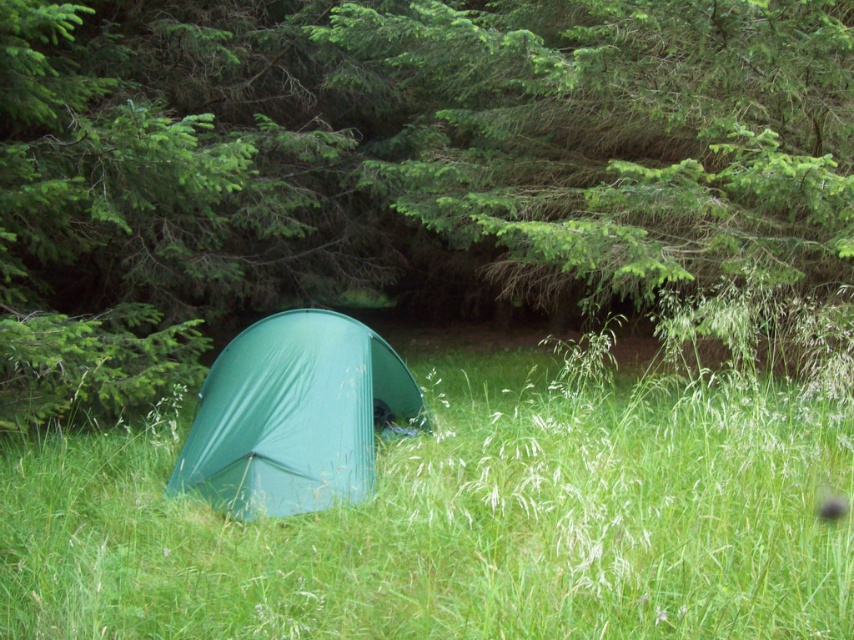
You are planning to set up a tent in this grassy area. You have two options available to you, the green fabric tent at center and the green tarpaulin tent at center. Considering the space available, which one would you choose and why?

The green fabric tent at center has a smaller size compared to the green tarpaulin tent at center. Therefore, if space is a concern, the green fabric tent at center would be the better choice as it requires less space to set up.

You are a hiker who wants to set up a tent in this area. You have two tents available, the green matte tent at center and the green tarpaulin tent at center. If you want to place them side by side along the same path, which tent should you place first so that the other can be positioned to its left?

The green tarpaulin tent at center should be placed first so that the green matte tent at center can be positioned to its right side.

You are planning to set up a camping site and have both the green matte tent at center and the green tarpaulin tent at center available. Which one should you choose if you want the larger one for more space?

The green matte tent at center is bigger than the green tarpaulin tent at center, so you should choose the green matte tent at center for more space.